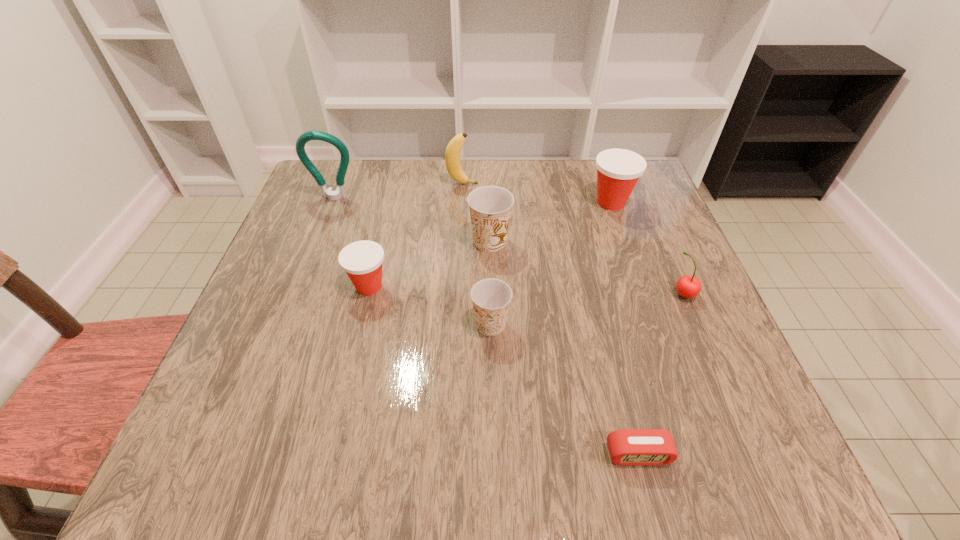
The width and height of the screenshot is (960, 540). I want to click on bottle opener, so click(x=340, y=192).

Locate an element on the screen. the tallest object is located at coordinates (340, 192).

This screenshot has height=540, width=960. In order to click on the farthest object in this screenshot , I will do `click(452, 154)`.

Find the location of a particular element. This screenshot has width=960, height=540. the seventh shortest object is located at coordinates [452, 154].

This screenshot has height=540, width=960. What are the coordinates of `the bigger red-orange Dixie cup` in the screenshot? It's located at (618, 170).

I want to click on the right red-orange Dixie cup, so click(x=618, y=170).

Where is `the fifth nearest object`? the fifth nearest object is located at coordinates (490, 207).

Identify the location of the bigger orange Dixie cup. Image resolution: width=960 pixels, height=540 pixels. (490, 207).

At what (x,y) coordinates should I click in order to perform the action: click on the rightmost object. Please return your answer as a coordinate pair (x, y). This screenshot has width=960, height=540. Looking at the image, I should click on (688, 286).

At what (x,y) coordinates should I click in order to perform the action: click on red cherry. Please return your answer as a coordinate pair (x, y). This screenshot has height=540, width=960. Looking at the image, I should click on (688, 286).